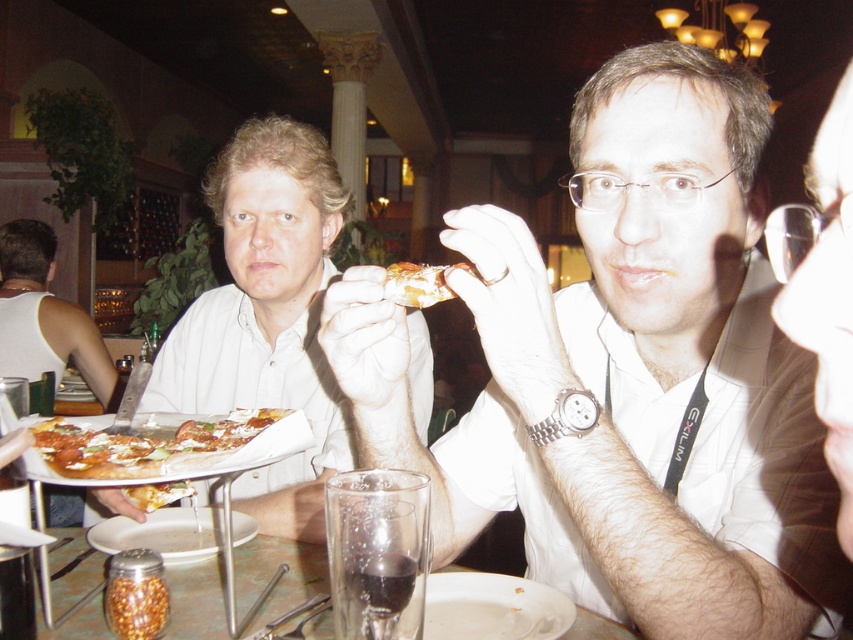
You are a waiter in a restaurant and you see a matte white shirt at left and a clear glass at lower center. Which object is closer to you from your perspective?

The matte white shirt at left is closer to you because it is positioned over the clear glass at lower center, indicating it is in front spatially.

You are a waiter in a restaurant and need to place a dessert plate between the matte white shirt at left and the clear glass at lower center. Considering their sizes, which object should the dessert plate be placed closer to?

The dessert plate should be placed closer to the clear glass at lower center because the matte white shirt at left has a larger size compared to the clear glass at lower center, so the glass is smaller and requires less space.

You are a food delivery person who needs to place a small drink between the matte white shirt at left and the cheesy pizza at center. The drink requires 10 inches of space. Is there enough space between them?

The matte white shirt at left is 16.38 inches away from the cheesy pizza at center. Since the required space is 10 inches, there is sufficient space to place the drink between them.